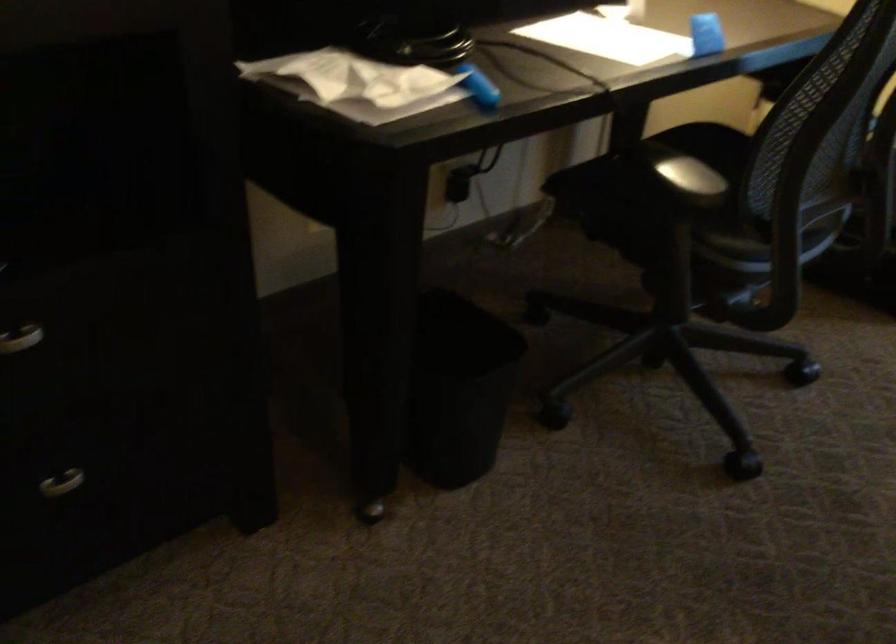
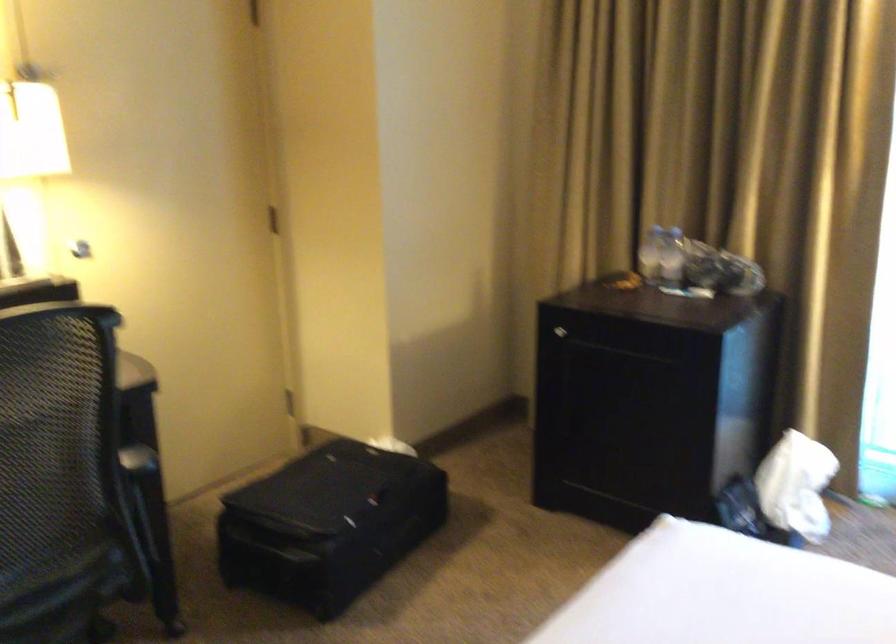
Question: Which direction would the cameraman need to move to produce the second image? Reply with the corresponding letter.

Choices:
 (A) Left
 (B) Right
 (C) Forward
 (D) Backward

Answer: (B)